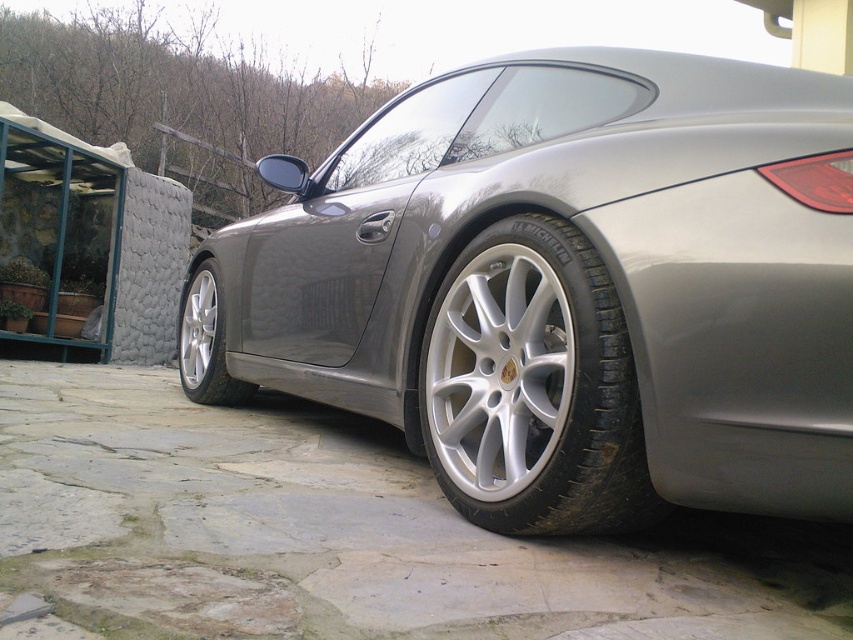
Can you confirm if satin silver car at center is thinner than silver metallic tire at lower center?

No.

What do you see at coordinates (573, 285) in the screenshot? The width and height of the screenshot is (853, 640). I see `satin silver car at center` at bounding box center [573, 285].

Identify the location of satin silver car at center. This screenshot has height=640, width=853. (573, 285).

Can you confirm if satin silver car at center is wider than silver metallic wheel at lower left?

Indeed, satin silver car at center has a greater width compared to silver metallic wheel at lower left.

Which is in front, point (695, 176) or point (180, 368)?

Point (695, 176)

Locate an element on the screen. This screenshot has height=640, width=853. satin silver car at center is located at coordinates (573, 285).

From the picture: Who is more forward, (726, 540) or (195, 316)?

Positioned in front is point (726, 540).

Does gray stone driveway at lower center appear under silver metallic rim at center?

Indeed, gray stone driveway at lower center is positioned under silver metallic rim at center.

The image size is (853, 640). I want to click on gray stone driveway at lower center, so click(x=340, y=534).

This screenshot has height=640, width=853. I want to click on gray stone driveway at lower center, so click(x=340, y=534).